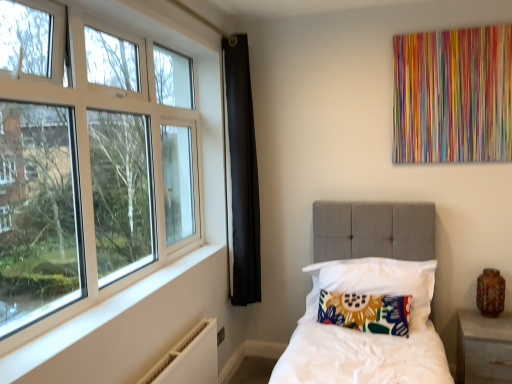
Question: Based on their sizes in the image, would you say floral fabric pillow at center, the 1th pillow viewed from the top, is bigger or smaller than white plastic window at left?

Choices:
 (A) small
 (B) big

Answer: (A)

Question: From the image's perspective, relative to white plastic window at left, is floral fabric pillow at center, the 1th pillow viewed from the top, above or below?

Choices:
 (A) above
 (B) below

Answer: (B)

Question: Considering the real-world distances, which object is closest to the matte gray nightstand at lower right?

Choices:
 (A) floral fabric pillow at center, marked as the 2th pillow in a bottom-to-top arrangement
 (B) white textured radiator at lower left
 (C) floral fabric pillow at center, the second pillow viewed from the top
 (D) white plastic window at left

Answer: (A)

Question: Which of these objects is positioned closest to the matte gray nightstand at lower right?

Choices:
 (A) white plastic window at left
 (B) floral fabric pillow at center, the second pillow viewed from the top
 (C) white textured radiator at lower left
 (D) floral fabric pillow at center, marked as the 2th pillow in a bottom-to-top arrangement

Answer: (D)